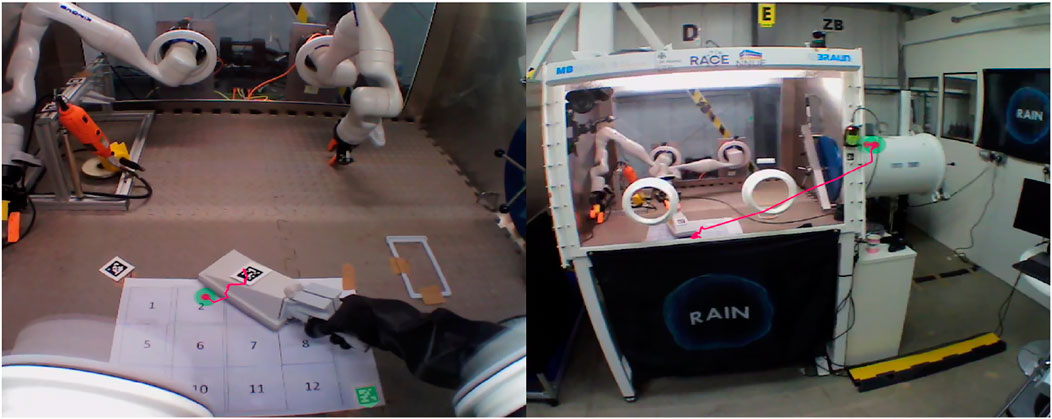
At what (x,y) coordinates should I click in order to perform the action: click on wall. Please return your answer as a coordinate pair (x, y). This screenshot has height=419, width=1052. Looking at the image, I should click on (1004, 220).